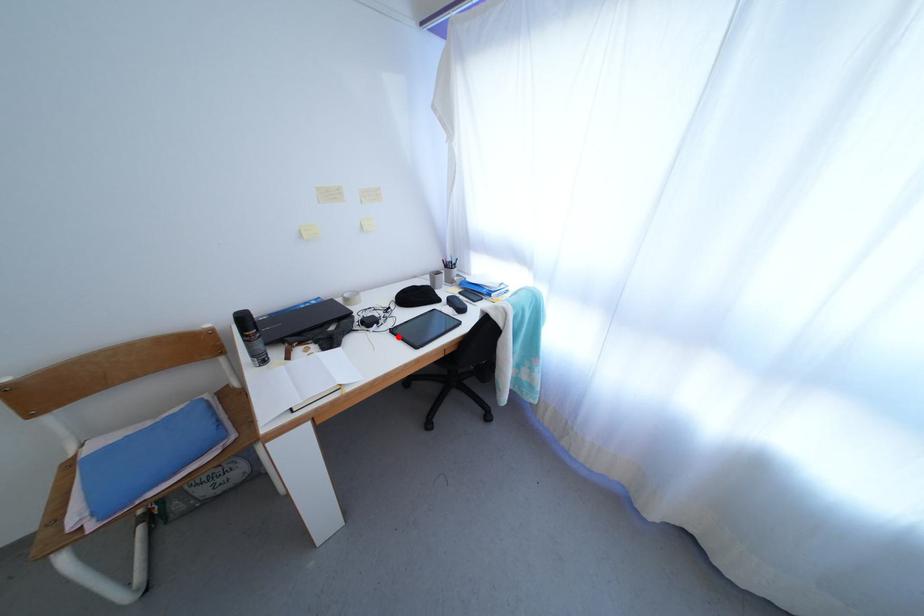
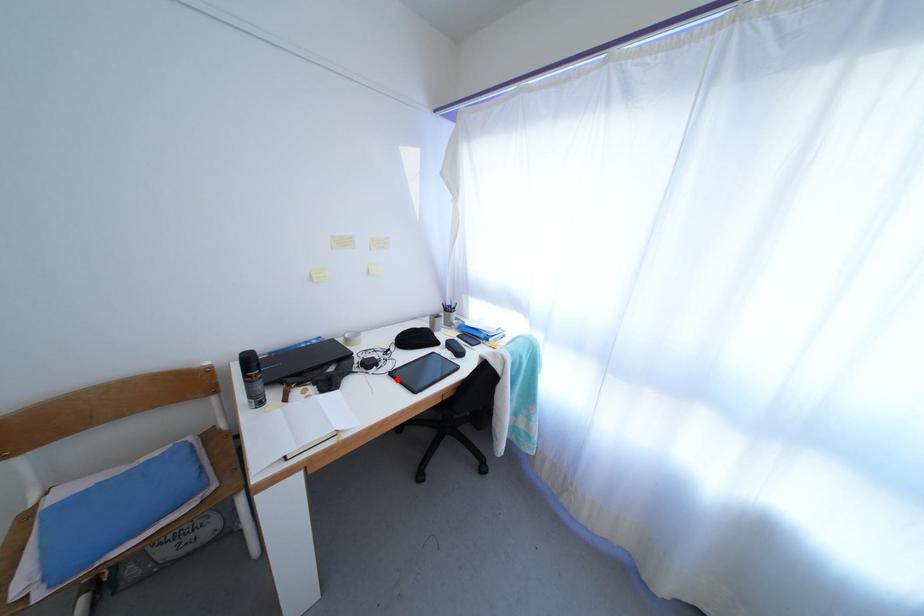
I am providing you with two images of the same scene from different viewpoints. A red point is marked on the first image and another point is marked on the second image. Is the red point in image1 aligned with the point shown in image2?

Yes